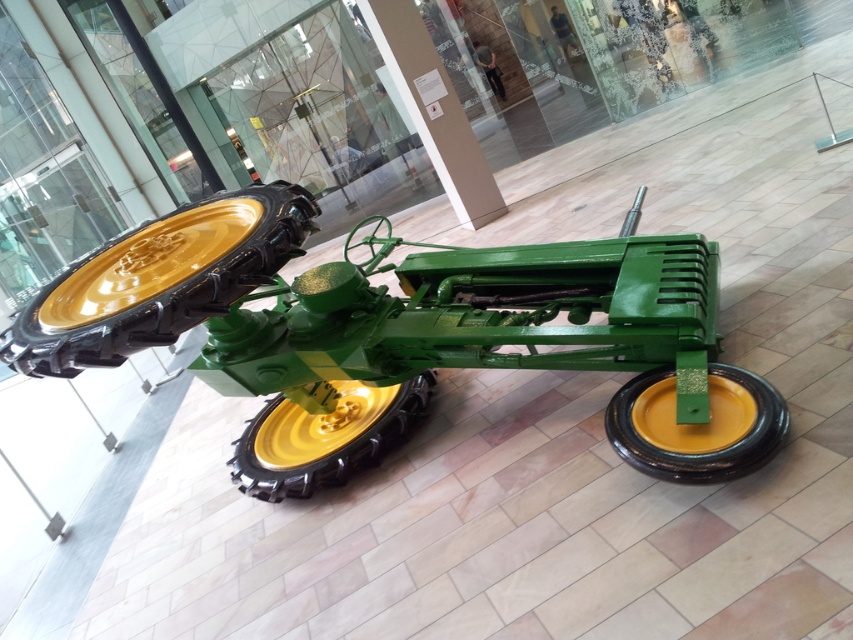
How far apart are shiny yellow rubber wheel at center and shiny yellow rimmed tire at center?

They are 5.47 feet apart.

Does shiny yellow rubber wheel at center appear on the right side of shiny yellow rimmed tire at center?

No, shiny yellow rubber wheel at center is not to the right of shiny yellow rimmed tire at center.

Locate an element on the screen. shiny yellow rubber wheel at center is located at coordinates (160, 280).

Find the location of a particular element. This screenshot has width=853, height=640. shiny yellow rubber wheel at center is located at coordinates (160, 280).

This screenshot has height=640, width=853. What do you see at coordinates (160, 280) in the screenshot?
I see `shiny yellow rubber wheel at center` at bounding box center [160, 280].

Looking at this image, which of these two, shiny yellow rubber wheel at center or yellow rubber wheel at center, stands shorter?

Standing shorter between the two is yellow rubber wheel at center.

What do you see at coordinates (160, 280) in the screenshot? I see `shiny yellow rubber wheel at center` at bounding box center [160, 280].

Locate an element on the screen. shiny yellow rubber wheel at center is located at coordinates (160, 280).

Can you confirm if green matte tractor at center is positioned to the right of shiny yellow rubber wheel at center?

Yes, green matte tractor at center is to the right of shiny yellow rubber wheel at center.

Is green matte tractor at center closer to camera compared to shiny yellow rubber wheel at center?

Yes, it is in front of shiny yellow rubber wheel at center.

Identify the location of green matte tractor at center. The image size is (853, 640). (405, 333).